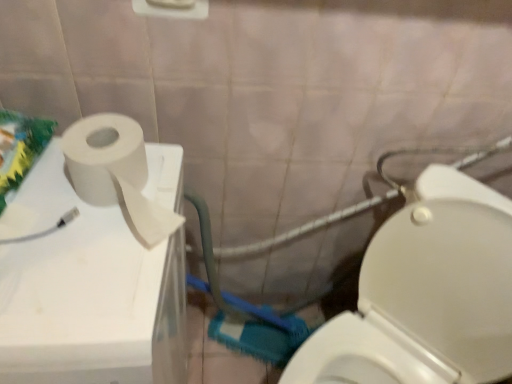
Find the location of a particular element. free region on the left part of white matte toilet paper at left is located at coordinates (39, 195).